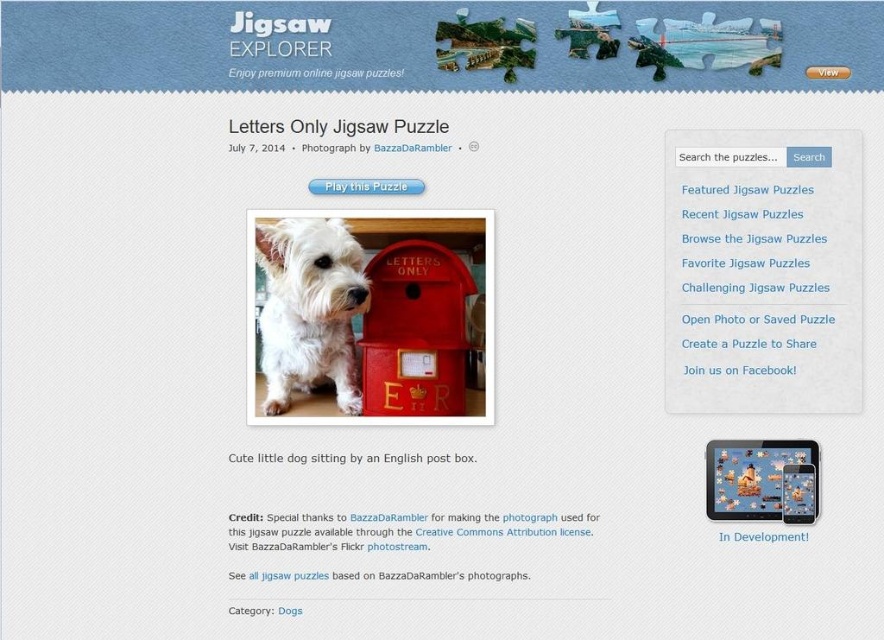
Between white fluffy dog at center and red matte mailbox at center, which one appears on the left side from the viewer's perspective?

white fluffy dog at center is more to the left.

Measure the distance between white fluffy dog at center and camera.

white fluffy dog at center and camera are 1.10 meters apart from each other.

Locate an element on the screen. The image size is (884, 640). white fluffy dog at center is located at coordinates (309, 308).

Which is more to the right, red matte mailbox at center or metallic silver tablet at center?

From the viewer's perspective, metallic silver tablet at center appears more on the right side.

How much distance is there between red matte mailbox at center and metallic silver tablet at center?

red matte mailbox at center is 13.14 inches away from metallic silver tablet at center.

Is point (397, 330) positioned after point (798, 465)?

Yes, it is.

At what (x,y) coordinates should I click in order to perform the action: click on red matte mailbox at center. Please return your answer as a coordinate pair (x, y). Looking at the image, I should click on (415, 330).

Who is more forward, (265, 232) or (776, 500)?

Point (776, 500) is in front.

Is white fluffy dog at center thinner than metallic silver tablet at center?

No.

Find the location of a particular element. white fluffy dog at center is located at coordinates (309, 308).

The height and width of the screenshot is (640, 884). I want to click on white fluffy dog at center, so click(309, 308).